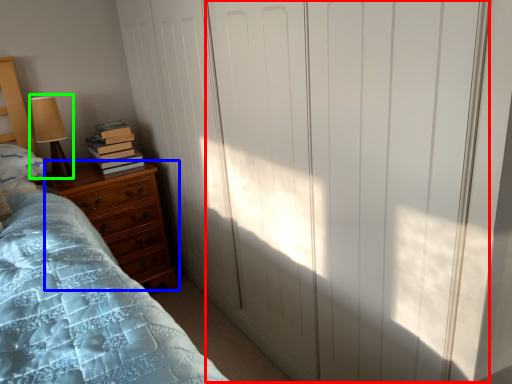
Question: Estimate the real-world distances between objects in this image. Which object is farther from screen door (highlighted by a red box), chest of drawers (highlighted by a blue box) or table lamp (highlighted by a green box)?

Choices:
 (A) chest of drawers
 (B) table lamp

Answer: (B)